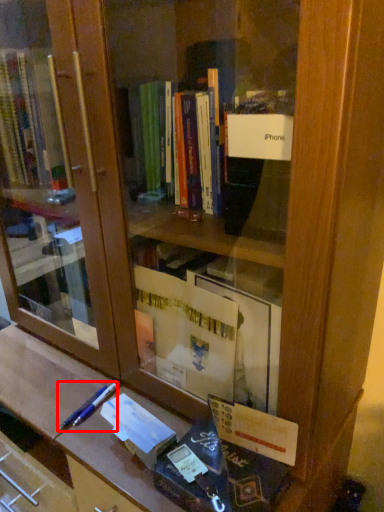
Question: Where is pencil (annotated by the red box) located in relation to paperback book in the image?

Choices:
 (A) left
 (B) right

Answer: (A)